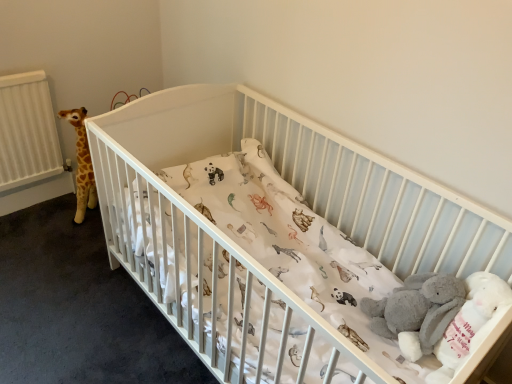
Question: Can you confirm if gray plush baby elephant at lower right is smaller than white matte crib at center?

Choices:
 (A) no
 (B) yes

Answer: (B)

Question: Is gray plush baby elephant at lower right far from white matte crib at center?

Choices:
 (A) no
 (B) yes

Answer: (A)

Question: Considering the relative positions of gray plush baby elephant at lower right and white matte crib at center in the image provided, is gray plush baby elephant at lower right to the right of white matte crib at center from the viewer's perspective?

Choices:
 (A) yes
 (B) no

Answer: (A)

Question: From the image's perspective, would you say gray plush baby elephant at lower right is positioned over white matte crib at center?

Choices:
 (A) no
 (B) yes

Answer: (A)

Question: Is gray plush baby elephant at lower right bigger than white matte crib at center?

Choices:
 (A) no
 (B) yes

Answer: (A)

Question: From a real-world perspective, is gray plush baby elephant at lower right physically below white matte crib at center?

Choices:
 (A) no
 (B) yes

Answer: (A)

Question: Is white matte crib at center positioned far away from gray plush baby elephant at lower right?

Choices:
 (A) no
 (B) yes

Answer: (A)

Question: Is white matte crib at center facing towards gray plush baby elephant at lower right?

Choices:
 (A) no
 (B) yes

Answer: (A)

Question: Is white matte crib at center thinner than gray plush baby elephant at lower right?

Choices:
 (A) yes
 (B) no

Answer: (B)

Question: Is white matte crib at center next to gray plush baby elephant at lower right and touching it?

Choices:
 (A) no
 (B) yes

Answer: (A)

Question: From the image's perspective, is white matte crib at center above gray plush baby elephant at lower right?

Choices:
 (A) no
 (B) yes

Answer: (B)

Question: Does white matte crib at center have a larger size compared to gray plush baby elephant at lower right?

Choices:
 (A) no
 (B) yes

Answer: (B)

Question: From a real-world perspective, is white matte crib at center above or below gray plush baby elephant at lower right?

Choices:
 (A) above
 (B) below

Answer: (B)